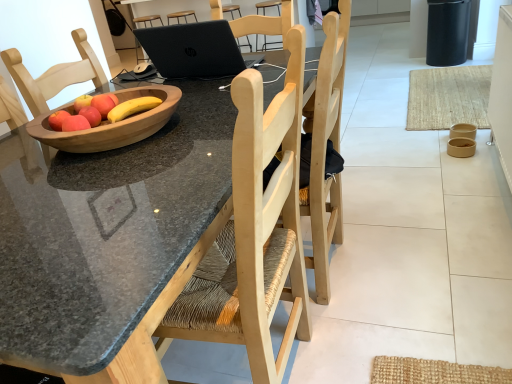
I want to click on empty space that is ontop of brown paper bowl at lower right, which ranks as the 2th bowl in back-to-front order (from a real-world perspective), so click(462, 142).